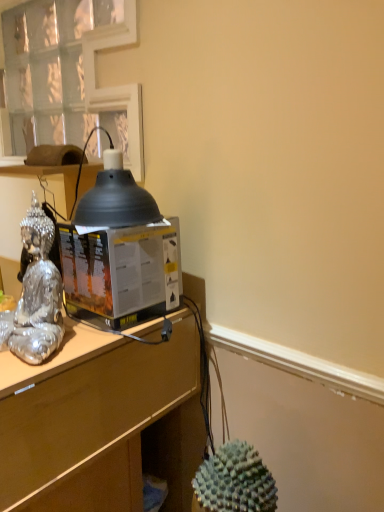
Question: Is the position of silver reflective statue at left more distant than that of matte black lampshade at upper left?

Choices:
 (A) no
 (B) yes

Answer: (A)

Question: From the image's perspective, is silver reflective statue at left on matte black lampshade at upper left?

Choices:
 (A) yes
 (B) no

Answer: (B)

Question: Does silver reflective statue at left have a smaller size compared to matte black lampshade at upper left?

Choices:
 (A) yes
 (B) no

Answer: (A)

Question: Would you say silver reflective statue at left contains matte black lampshade at upper left?

Choices:
 (A) yes
 (B) no

Answer: (B)

Question: Considering the relative positions of silver reflective statue at left and matte black lampshade at upper left in the image provided, is silver reflective statue at left to the right of matte black lampshade at upper left from the viewer's perspective?

Choices:
 (A) yes
 (B) no

Answer: (A)

Question: Based on their sizes in the image, would you say matte black lampshade at upper center is bigger or smaller than transparent plastic desktop computer at center?

Choices:
 (A) big
 (B) small

Answer: (B)

Question: From the image's perspective, is matte black lampshade at upper center located above or below transparent plastic desktop computer at center?

Choices:
 (A) below
 (B) above

Answer: (B)

Question: Considering their positions, is matte black lampshade at upper center located in front of or behind transparent plastic desktop computer at center?

Choices:
 (A) behind
 (B) front

Answer: (B)

Question: Considering the relative positions of matte black lampshade at upper center and transparent plastic desktop computer at center in the image provided, is matte black lampshade at upper center to the left or to the right of transparent plastic desktop computer at center?

Choices:
 (A) left
 (B) right

Answer: (B)

Question: Considering their positions, is clear glass window at upper left located in front of or behind matte black lampshade at upper left?

Choices:
 (A) front
 (B) behind

Answer: (B)

Question: Is clear glass window at upper left spatially inside matte black lampshade at upper left, or outside of it?

Choices:
 (A) outside
 (B) inside

Answer: (A)

Question: Based on their sizes in the image, would you say clear glass window at upper left is bigger or smaller than matte black lampshade at upper left?

Choices:
 (A) big
 (B) small

Answer: (A)

Question: Does point (132, 173) appear closer or farther from the camera than point (54, 181)?

Choices:
 (A) closer
 (B) farther

Answer: (A)

Question: Considering the relative positions of transparent plastic desktop computer at center and matte black lampshade at upper left in the image provided, is transparent plastic desktop computer at center to the left or to the right of matte black lampshade at upper left?

Choices:
 (A) right
 (B) left

Answer: (A)

Question: Do you think transparent plastic desktop computer at center is within matte black lampshade at upper left, or outside of it?

Choices:
 (A) inside
 (B) outside

Answer: (B)